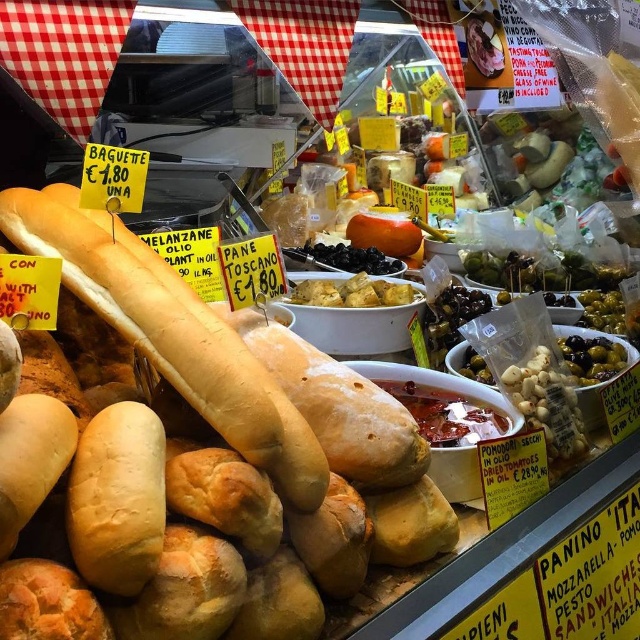
Question: Does golden brown crusty baguette at center appear on the right side of golden brown croutons at center?

Choices:
 (A) no
 (B) yes

Answer: (A)

Question: Which of the following is the farthest from the observer?

Choices:
 (A) golden brown crusty baguette at center
 (B) golden brown croutons at center

Answer: (B)

Question: Which object appears farthest from the camera in this image?

Choices:
 (A) golden brown croutons at center
 (B) golden brown crusty baguette at center

Answer: (A)

Question: Does golden brown crusty baguette at center have a lesser width compared to golden brown croutons at center?

Choices:
 (A) no
 (B) yes

Answer: (A)

Question: Considering the relative positions of golden brown crusty baguette at center and golden brown croutons at center in the image provided, where is golden brown crusty baguette at center located with respect to golden brown croutons at center?

Choices:
 (A) below
 (B) above

Answer: (A)

Question: Which object appears closest to the camera in this image?

Choices:
 (A) golden brown croutons at center
 (B) golden brown crusty baguette at center

Answer: (B)